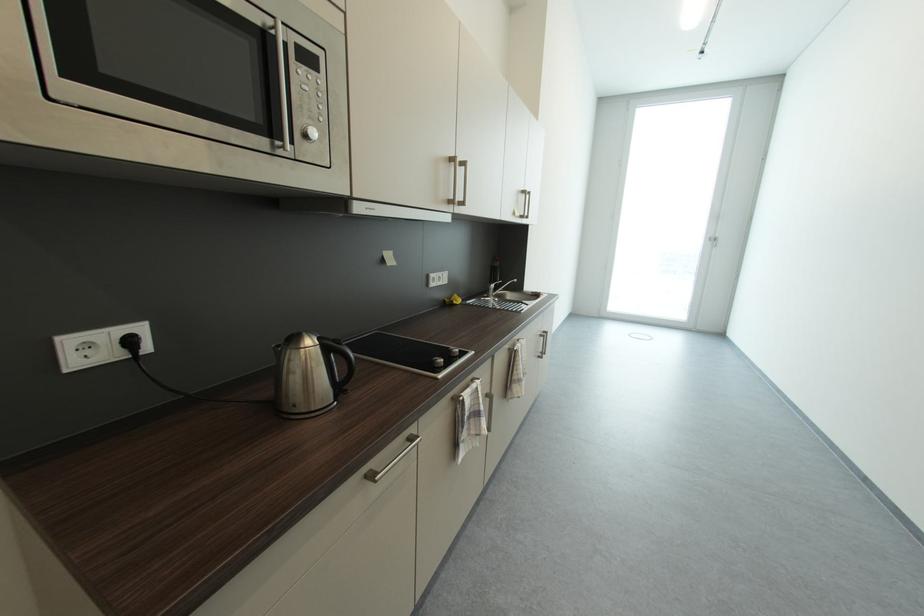
Which object does [130,344] point to?

It refers to a black electrical plug.